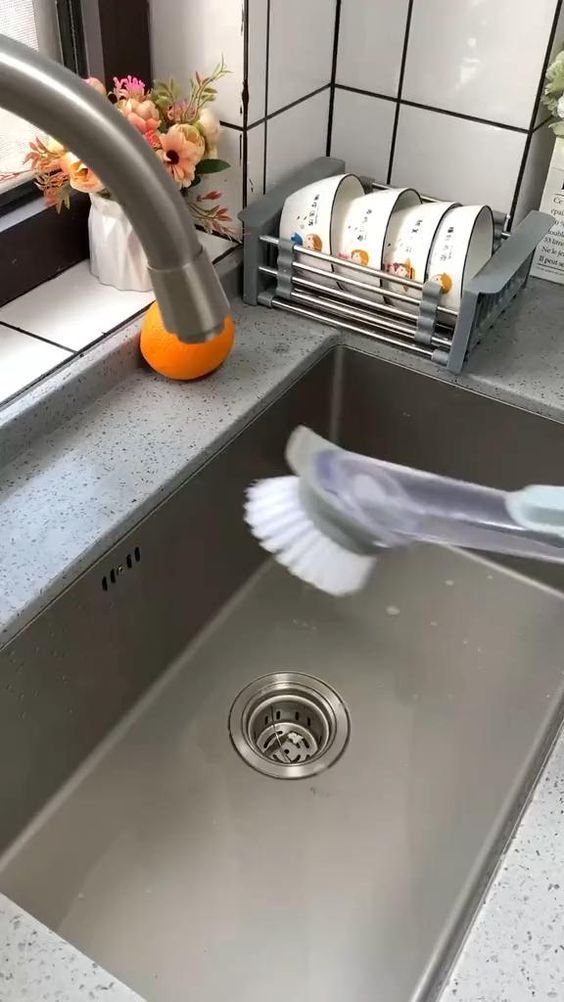
This screenshot has width=564, height=1002. I want to click on dish drainer, so click(x=425, y=332).